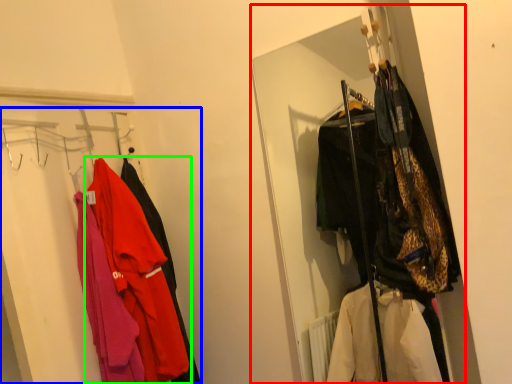
Question: Which object is the farthest from closet (highlighted by a red box)? Choose among these: closet (highlighted by a blue box) or jacket (highlighted by a green box).

Choices:
 (A) closet
 (B) jacket

Answer: (B)